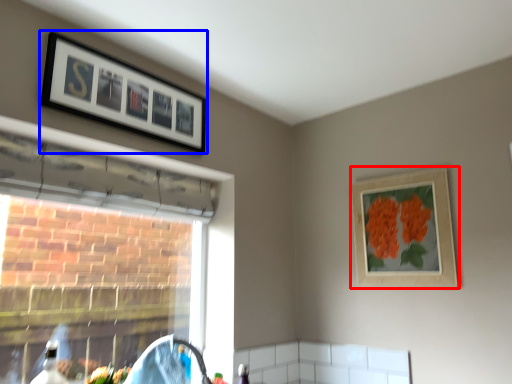
Question: Which of the following is the farthest to the observer, picture frame (highlighted by a red box) or picture frame (highlighted by a blue box)?

Choices:
 (A) picture frame
 (B) picture frame

Answer: (A)